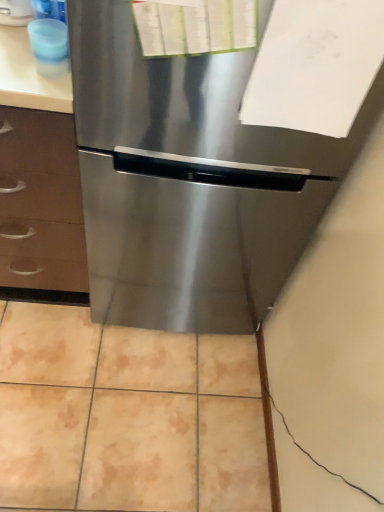
Question: Can you confirm if white matte paper at upper right is bigger than beige ceramic tile at center?

Choices:
 (A) yes
 (B) no

Answer: (B)

Question: Considering the relative sizes of white matte paper at upper right and beige ceramic tile at center in the image provided, is white matte paper at upper right smaller than beige ceramic tile at center?

Choices:
 (A) no
 (B) yes

Answer: (B)

Question: From the image's perspective, does white matte paper at upper right appear higher than beige ceramic tile at center?

Choices:
 (A) yes
 (B) no

Answer: (A)

Question: From the image's perspective, is white matte paper at upper right beneath beige ceramic tile at center?

Choices:
 (A) yes
 (B) no

Answer: (B)

Question: Considering the relative sizes of white matte paper at upper right and beige ceramic tile at center in the image provided, is white matte paper at upper right shorter than beige ceramic tile at center?

Choices:
 (A) no
 (B) yes

Answer: (A)

Question: From the image's perspective, relative to translucent blue cup at upper left, is stainless steel refrigerator at center above or below?

Choices:
 (A) above
 (B) below

Answer: (B)

Question: Considering their positions, is stainless steel refrigerator at center located in front of or behind translucent blue cup at upper left?

Choices:
 (A) front
 (B) behind

Answer: (A)

Question: Is stainless steel refrigerator at center inside the boundaries of translucent blue cup at upper left, or outside?

Choices:
 (A) inside
 (B) outside

Answer: (B)

Question: From a real-world perspective, is stainless steel refrigerator at center above or below translucent blue cup at upper left?

Choices:
 (A) above
 (B) below

Answer: (B)

Question: Is point (269, 23) positioned closer to the camera than point (8, 460)?

Choices:
 (A) farther
 (B) closer

Answer: (B)

Question: From a real-world perspective, relative to beige ceramic tile at center, is white matte paper at upper right vertically above or below?

Choices:
 (A) below
 (B) above

Answer: (B)

Question: From their relative heights in the image, would you say white matte paper at upper right is taller or shorter than beige ceramic tile at center?

Choices:
 (A) tall
 (B) short

Answer: (A)

Question: Is white matte paper at upper right wider or thinner than beige ceramic tile at center?

Choices:
 (A) wide
 (B) thin

Answer: (B)

Question: From the image's perspective, is white matte paper at upper right positioned above or below stainless steel refrigerator at center?

Choices:
 (A) above
 (B) below

Answer: (A)

Question: In the image, is white matte paper at upper right positioned in front of or behind stainless steel refrigerator at center?

Choices:
 (A) behind
 (B) front

Answer: (A)